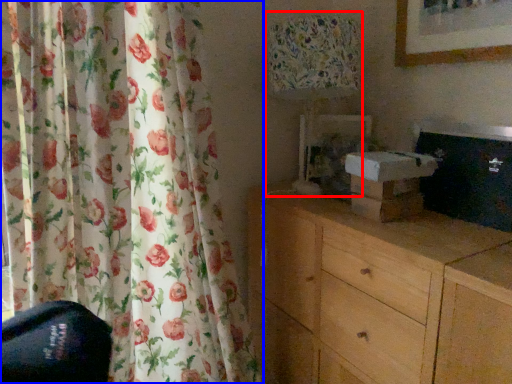
Question: Which object is further to the camera taking this photo, table lamp (highlighted by a red box) or curtain (highlighted by a blue box)?

Choices:
 (A) table lamp
 (B) curtain

Answer: (A)